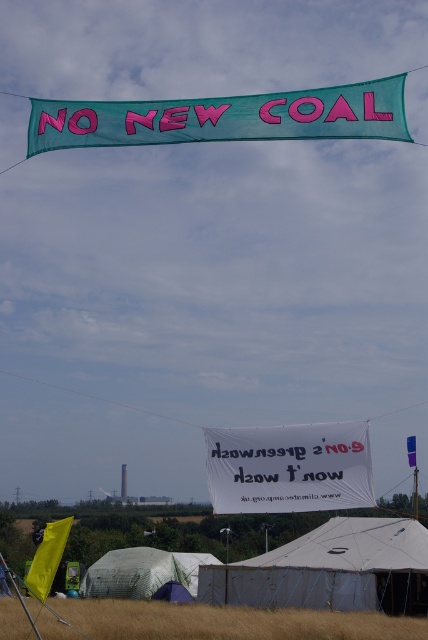
You are standing in the outdoor scene looking up. There is a large banner above you and a white fabric banner at center. Which banner is higher up in the sky?

The large banner is higher up in the sky than the white fabric banner at center because the white fabric banner at center is located at point (288, 467), which is closer to the ground compared to the large banner dominating the upper portion of the frame.

You are a drone operator tasked with capturing aerial footage of the protest event. You need to fly your drone from the teal fabric banner at upper center to the transparent plastic tent at lower center. Given that your drone has a maximum flight range of 50 meters, will it be able to reach the tent without needing to recharge?

The distance between the teal fabric banner at upper center and the transparent plastic tent at lower center is 45.82 meters. Since the drone has a maximum flight range of 50 meters, it can reach the tent without needing to recharge.

You are a person trying to set up a tent in the area shown. You see the brown grass at lower center and the transparent plastic tent at lower center. Which object is taller, and will the tent be visible from above when placed there?

The brown grass at lower center is much taller than the transparent plastic tent at lower center. Therefore, when placing the transparent plastic tent at lower center, it may not be fully visible from above due to the taller grass obstructing the view.